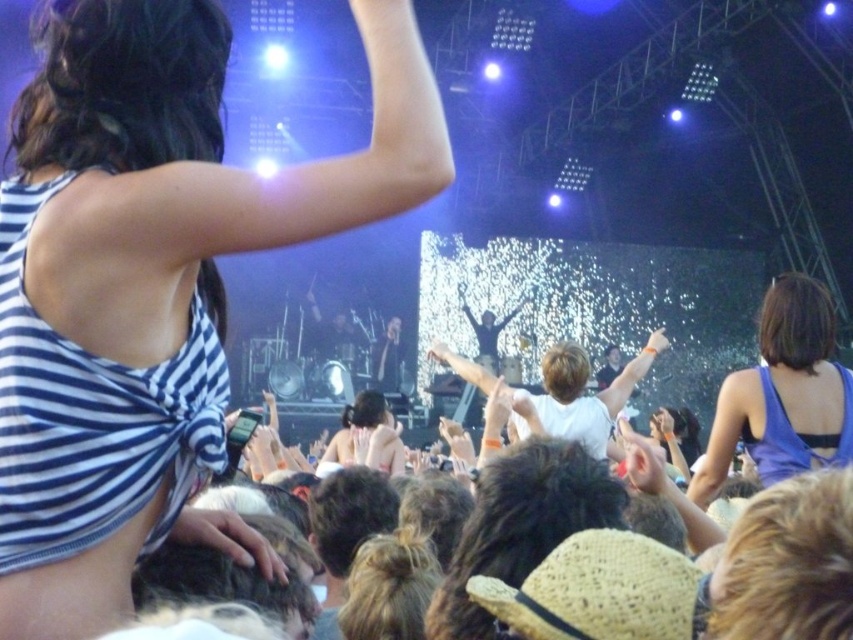
Question: Which object appears farthest from the camera in this image?

Choices:
 (A) blue satin dress at upper right
 (B) striped fabric tank top at upper left

Answer: (A)

Question: Which of the following is the closest to the observer?

Choices:
 (A) blue satin dress at upper right
 (B) striped fabric tank top at upper left

Answer: (B)

Question: Does striped fabric tank top at upper left have a larger size compared to blue satin dress at upper right?

Choices:
 (A) no
 (B) yes

Answer: (A)

Question: Does striped fabric tank top at upper left have a greater width compared to blue satin dress at upper right?

Choices:
 (A) no
 (B) yes

Answer: (A)

Question: Observing the image, what is the correct spatial positioning of striped fabric tank top at upper left in reference to blue satin dress at upper right?

Choices:
 (A) below
 (B) above

Answer: (B)